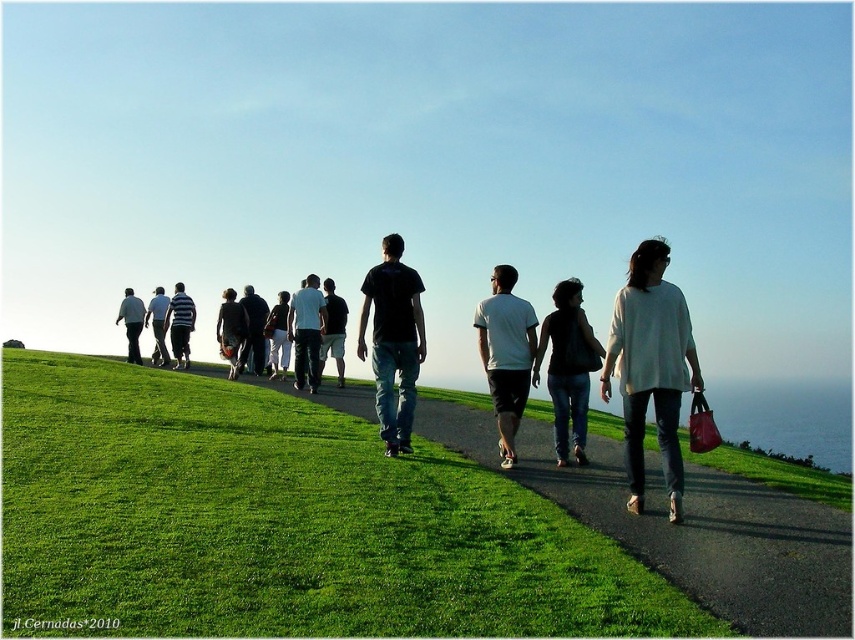
Between white matte sweater at center-right and dark gray hoodie at center, which one has less height?

With less height is dark gray hoodie at center.

Between point (621, 333) and point (275, 326), which one is positioned in front?

Positioned in front is point (621, 333).

The height and width of the screenshot is (640, 855). What are the coordinates of `white matte sweater at center-right` in the screenshot? It's located at (652, 368).

Measure the distance between green grass at center and camera.

4.12 meters

Locate an element on the screen. This screenshot has width=855, height=640. green grass at center is located at coordinates [x=280, y=524].

Does point (464, 545) come behind point (510, 420)?

No, (464, 545) is closer to viewer.

Identify the location of green grass at center. This screenshot has height=640, width=855. (280, 524).

Is dark gray shirt at center positioned behind dark gray hoodie at center?

No.

Which is behind, point (337, 353) or point (270, 369)?

Positioned behind is point (270, 369).

Image resolution: width=855 pixels, height=640 pixels. What do you see at coordinates (333, 330) in the screenshot?
I see `dark gray shirt at center` at bounding box center [333, 330].

What are the coordinates of `dark gray shirt at center` in the screenshot? It's located at (333, 330).